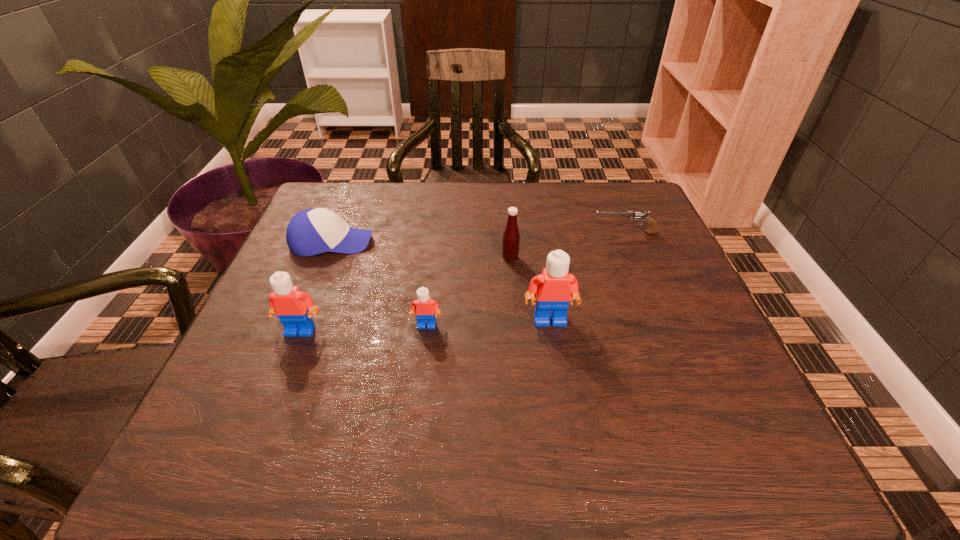
Find the location of `vacant space located 0.100m on the face of the rightmost Lego`. vacant space located 0.100m on the face of the rightmost Lego is located at coordinates (558, 368).

At what (x,y) coordinates should I click in order to perform the action: click on vacant space located aiming along the barrel of the shortest object. Please return your answer as a coordinate pair (x, y). The image size is (960, 540). Looking at the image, I should click on [x=434, y=234].

Locate an element on the screen. The image size is (960, 540). free space located aiming along the barrel of the shortest object is located at coordinates (513, 234).

This screenshot has height=540, width=960. What are the coordinates of `free space located aiming along the barrel of the shortest object` in the screenshot? It's located at [x=473, y=234].

I want to click on vacant space located 0.290m on the right of the Tabasco sauce, so click(641, 258).

I want to click on free space located on the front-facing side of the baseball cap, so click(498, 242).

This screenshot has width=960, height=540. Find the location of `object that is at the far edge`. object that is at the far edge is located at coordinates (310, 232).

Identify the location of Lego present at the left edge. (287, 302).

Identify the location of baseball cap that is at the left edge. (310, 232).

At what (x,y) coordinates should I click in order to perform the action: click on object that is at the right edge. Please return your answer as a coordinate pair (x, y). Looking at the image, I should click on (652, 229).